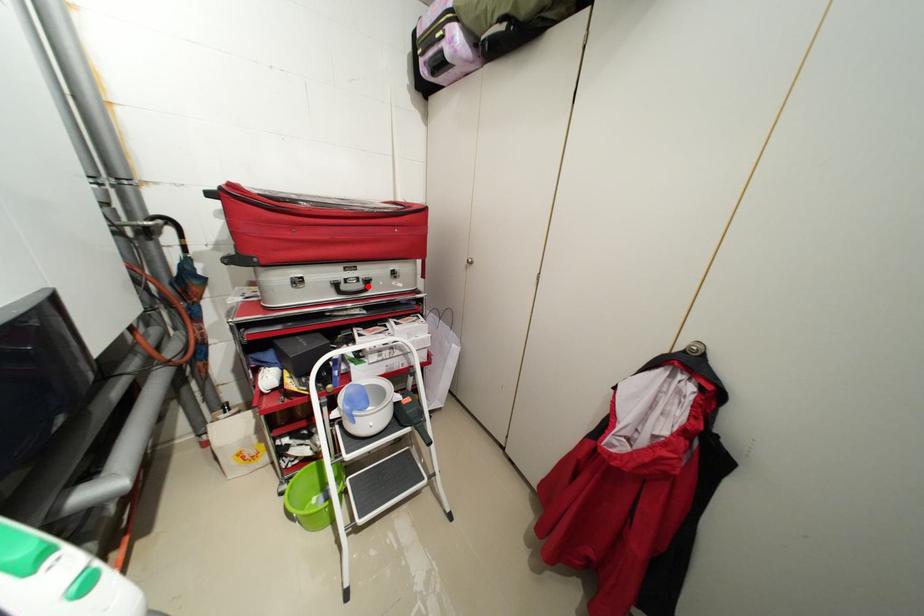
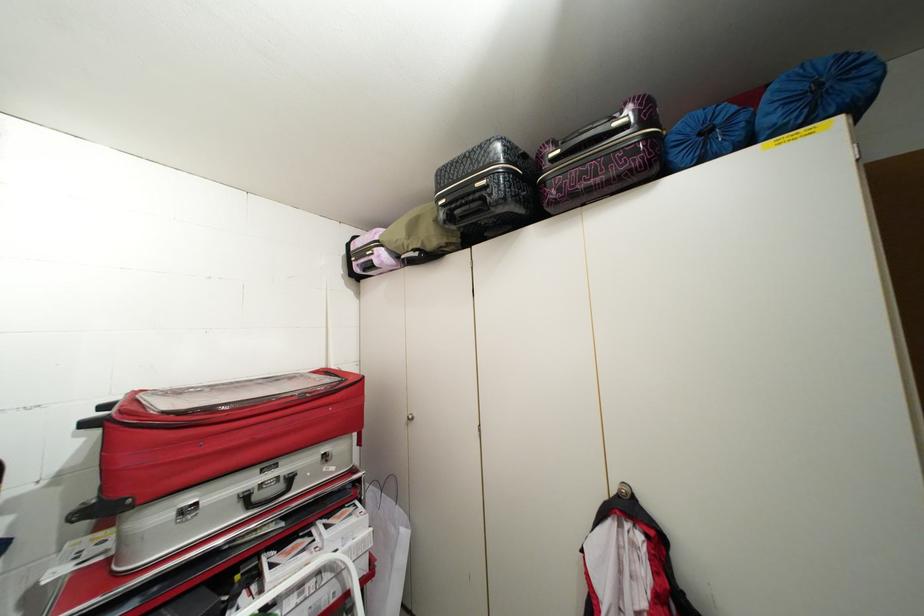
In the second image, find the point that corresponds to the highlighted location in the first image.

(287, 487)